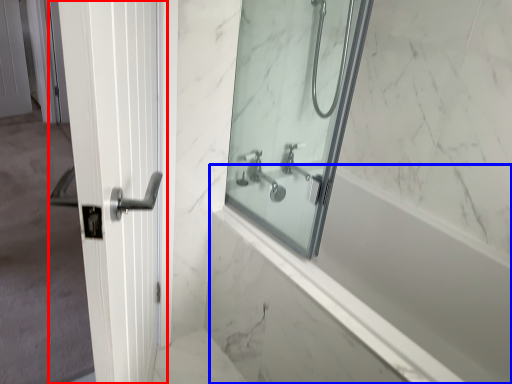
Question: Which object is closer to the camera taking this photo, door (highlighted by a red box) or bath (highlighted by a blue box)?

Choices:
 (A) door
 (B) bath

Answer: (A)